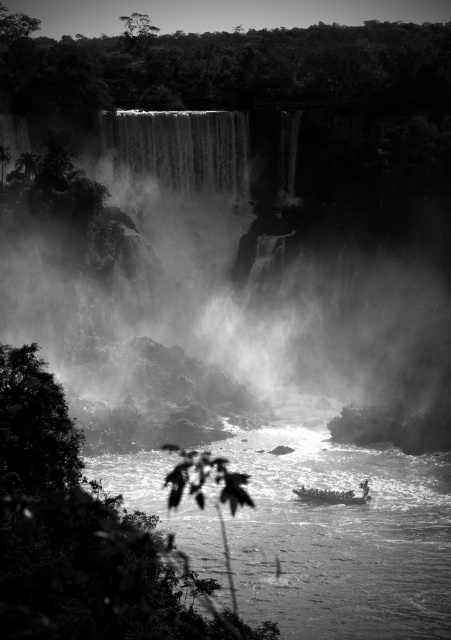
You are a photographer trying to capture the waterfall. You notice the foggy mist at center and the smooth water at lower center in your viewfinder. Which object should you adjust your camera to focus on if you want to highlight the misty foreground? Explain your choice based on their positions.

The foggy mist at center should be focused on because it is positioned to the left of the smooth water at lower center, making it closer to the foreground and thus ideal for emphasizing the misty atmosphere.

You are a photographer standing at the edge of the waterfall. You want to capture a photo of the wooden boat at center while ensuring the smooth water at lower center is visible in the frame. Based on their positions, which object should you focus on first to include both in the shot?

The smooth water at lower center is to the left of wooden boat at center. To include both in the frame, focus on the wooden boat at center first since it is positioned centrally and the smooth water at lower center is adjacent to it on the left.

You are a photographer standing at the edge of the waterfall. You notice the foggy mist at center and the wooden boat at center in the scene. Which object is positioned higher relative to the other?

The foggy mist at center is located above the wooden boat at center, so it is positioned higher.